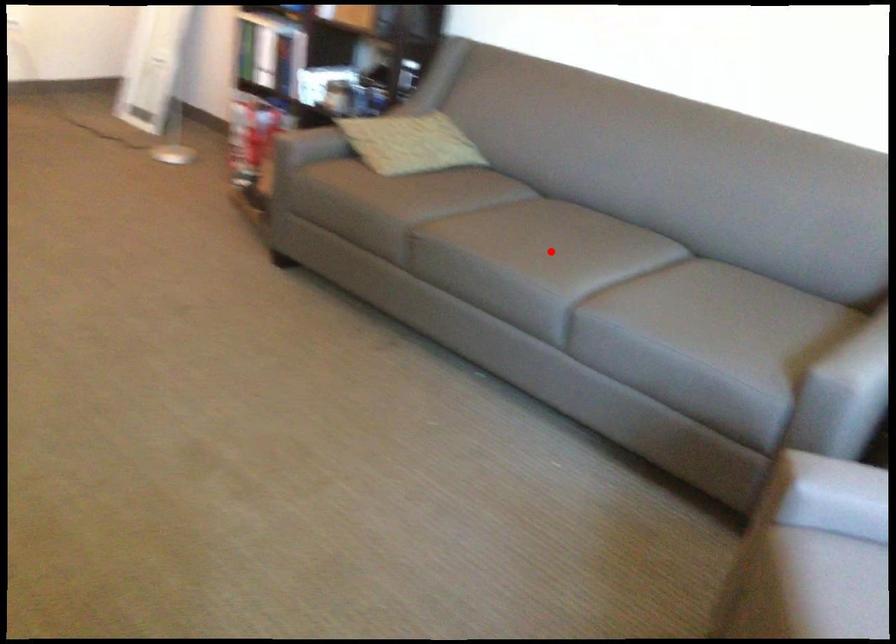
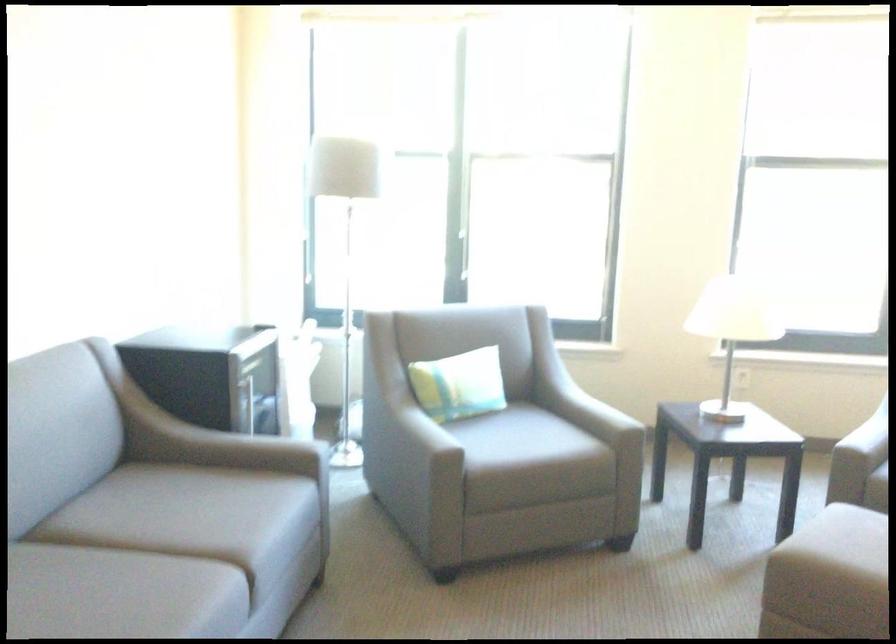
Find the pixel in the second image that matches the highlighted location in the first image.

(119, 594)